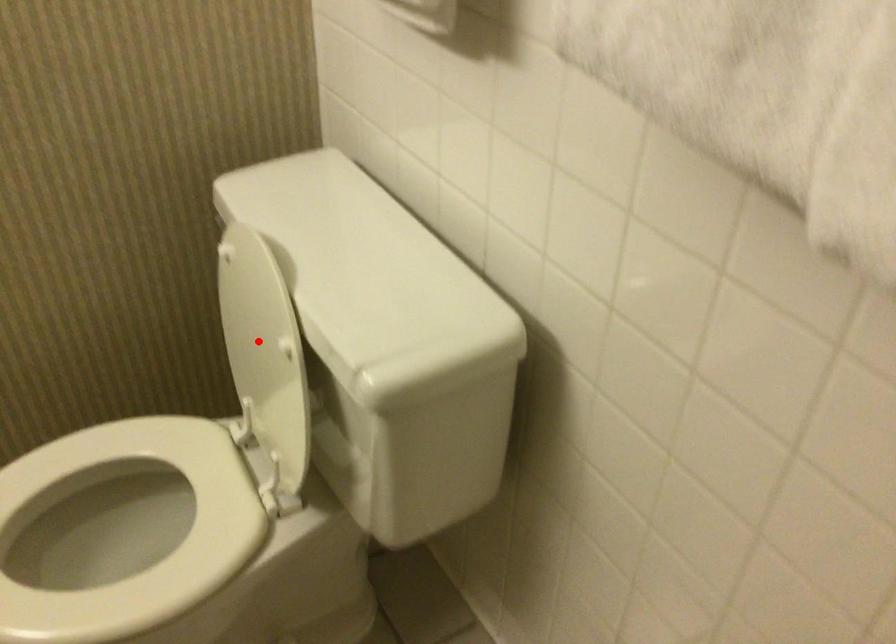
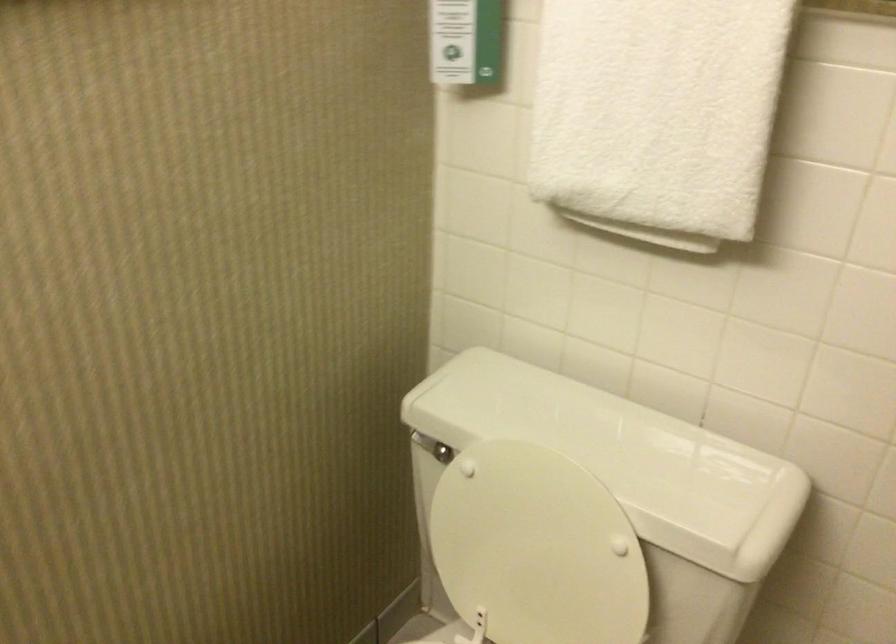
In the second image, find the point that corresponds to the highlighted location in the first image.

(536, 547)